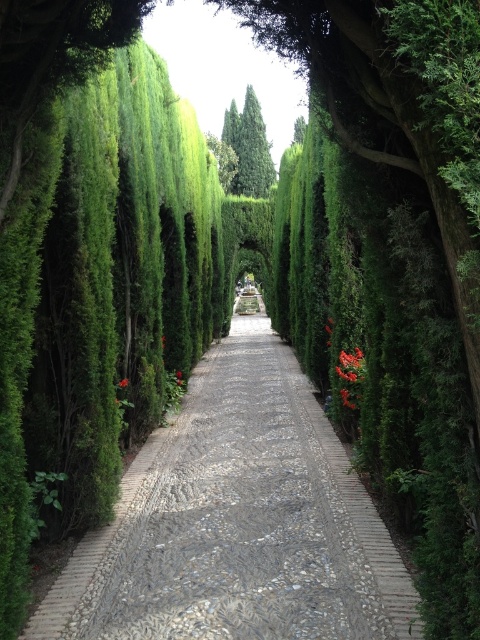
You are a gardener who wants to plant a new bush between the bright red berries at center and the red matte flower at center. Which side of the flower should you plant it on to keep it aligned with the existing garden layout?

You should plant the new bush to the right of the red matte flower at center, as the bright red berries at center are already positioned to the right of the flower, maintaining the alignment.

You are a gardener who needs to place a 3.5 meter long decorative fence between the bright red berries at center and the red matte flower at center. Can the fence fit between them without overlapping either object?

The distance between the bright red berries at center and the red matte flower at center is 4.36 meters. Since the fence is 3.5 meters long, it can fit between them without overlapping either object as there is enough space.

You are a gardener standing at the entrance of the garden pathway. You need to water both the green leafy tree at center and the red matte flower at center. Which object should you water first if you want to reach the one closer to you first?

The green leafy tree at center is closer to you than the red matte flower at center, so you should water the green leafy tree at center first.